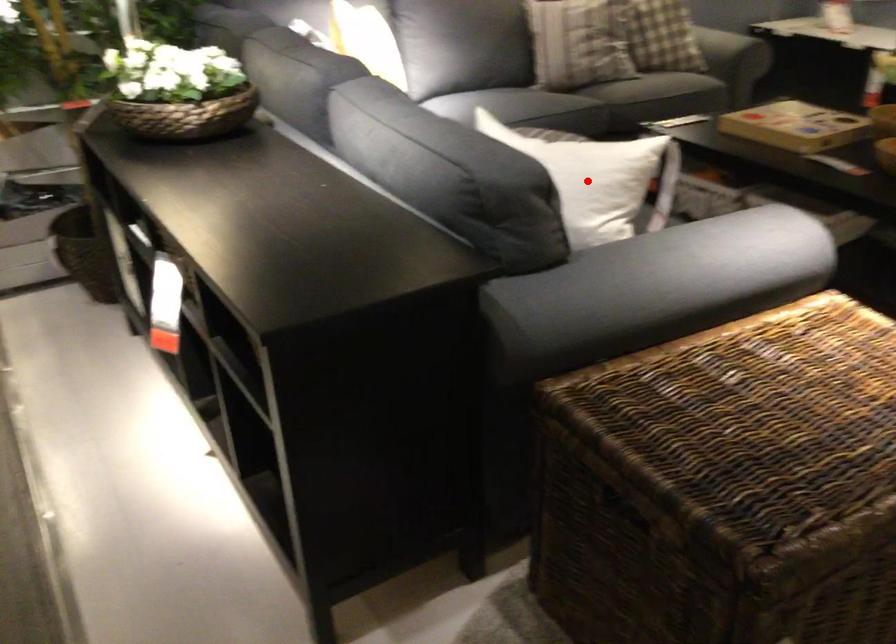
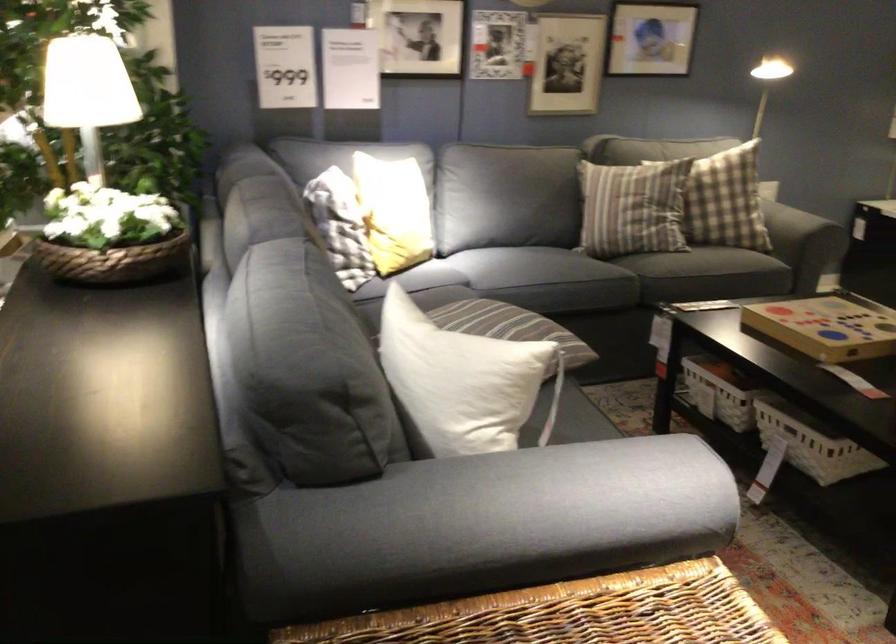
In the second image, find the point that corresponds to the highlighted location in the first image.

(462, 381)